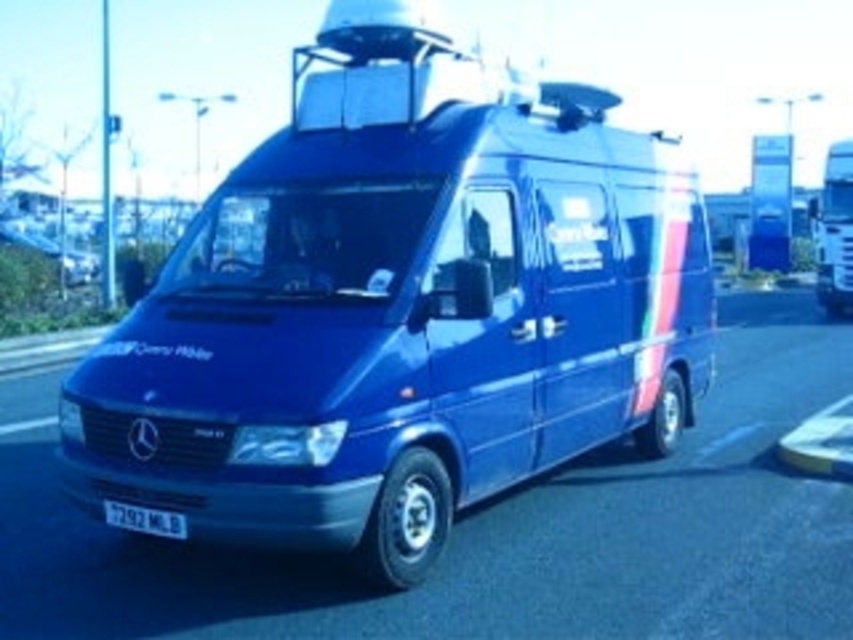
Is point (486, 532) more distant than point (834, 253)?

No, (486, 532) is closer to viewer.

In the scene shown: Does metallic blue van at center have a greater height compared to blue metallic van at right?

No.

Find the location of a particular element. metallic blue van at center is located at coordinates (496, 531).

Who is positioned more to the right, glossy blue van at center or blue metallic van at right?

blue metallic van at right is more to the right.

Is glossy blue van at center in front of blue metallic van at right?

Yes, glossy blue van at center is closer to the viewer.

Where is `glossy blue van at center`? This screenshot has height=640, width=853. glossy blue van at center is located at coordinates (402, 307).

Between glossy blue van at center and metallic blue van at center, which one appears on the left side from the viewer's perspective?

metallic blue van at center is more to the left.

Can you confirm if glossy blue van at center is taller than metallic blue van at center?

Yes.

Is point (502, 141) positioned in front of point (733, 330)?

Yes, it is in front of point (733, 330).

Image resolution: width=853 pixels, height=640 pixels. Identify the location of glossy blue van at center. (402, 307).